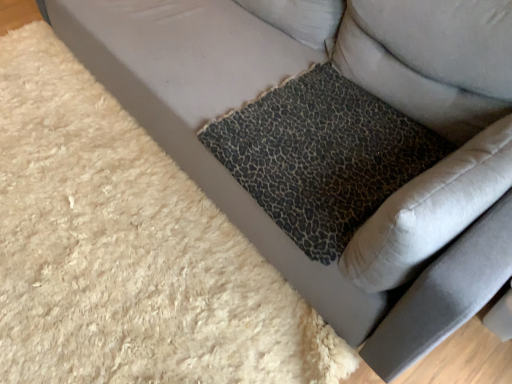
Question: From the image's perspective, is leopard print cushion at lower right above or below leopard print fabric pillow at upper right?

Choices:
 (A) above
 (B) below

Answer: (B)

Question: Looking at their shapes, would you say leopard print cushion at lower right is wider or thinner than leopard print fabric pillow at upper right?

Choices:
 (A) wide
 (B) thin

Answer: (A)

Question: Which object is positioned farthest from the leopard print fabric pillow at upper right?

Choices:
 (A) leopard print fabric cushion at center
 (B) leopard print cushion at lower right

Answer: (B)

Question: Which of these objects is positioned closest to the leopard print cushion at lower right?

Choices:
 (A) leopard print fabric pillow at upper right
 (B) leopard print fabric cushion at center

Answer: (B)